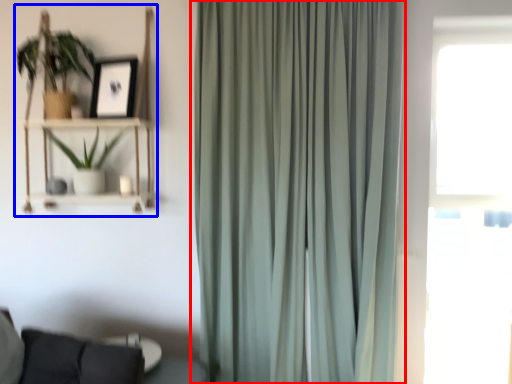
Question: Among these objects, which one is nearest to the camera, curtain (highlighted by a red box) or bookshelf (highlighted by a blue box)?

Choices:
 (A) curtain
 (B) bookshelf

Answer: (A)